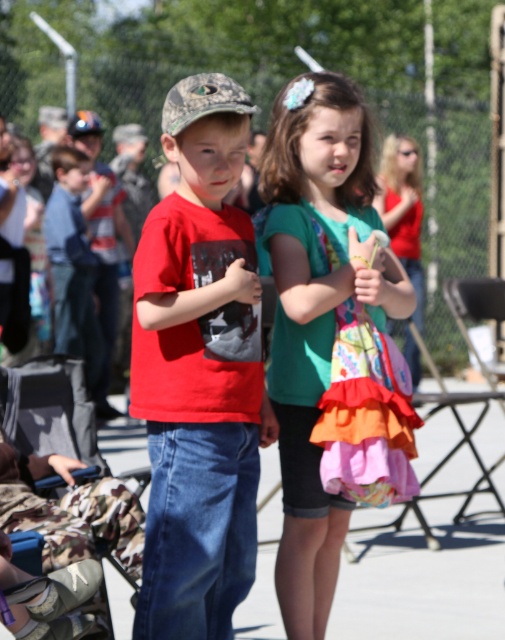
Between point (169, 209) and point (313, 612), which one is positioned in front?

Point (169, 209) is more forward.

Is matte red t-shirt at center wider than teal fabric dress at center?

No.

Who is more distant from viewer, (209, 620) or (300, 304)?

The point (300, 304) is more distant.

The height and width of the screenshot is (640, 505). Identify the location of matte red t-shirt at center. (198, 371).